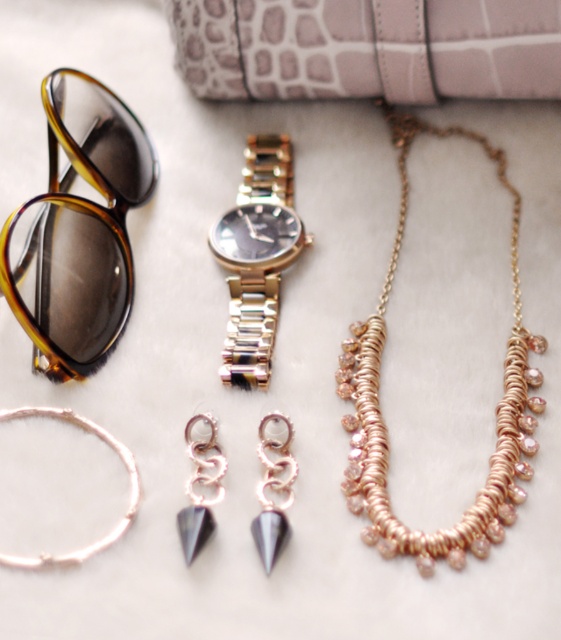
Question: Considering the real-world distances, which object is farthest from the gold metallic watch at center?

Choices:
 (A) silver metallic spike earrings at center
 (B) tortoiseshell acetate sunglasses at upper left

Answer: (A)

Question: Which point is farther from the camera taking this photo?

Choices:
 (A) (98, 337)
 (B) (393, 248)
 (C) (259, 481)
 (D) (254, 236)

Answer: (D)

Question: Does rose gold wire necklace at center have a lesser width compared to silver metallic spike earrings at center?

Choices:
 (A) no
 (B) yes

Answer: (A)

Question: Is tortoiseshell acetate sunglasses at upper left positioned at the back of rose gold wire necklace at center?

Choices:
 (A) yes
 (B) no

Answer: (A)

Question: Observing the image, what is the correct spatial positioning of tortoiseshell acetate sunglasses at upper left in reference to silver metallic spike earrings at center?

Choices:
 (A) below
 (B) above

Answer: (B)

Question: Which point is farther from the camera taking this photo?

Choices:
 (A) (401, 240)
 (B) (109, 100)
 (C) (260, 497)

Answer: (B)